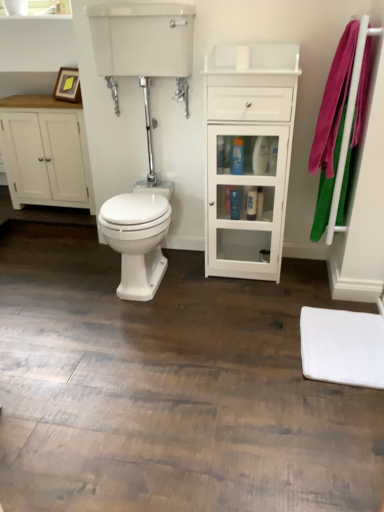
Find the location of `free spot to the left of white glossy bidet at center`. free spot to the left of white glossy bidet at center is located at coordinates (83, 280).